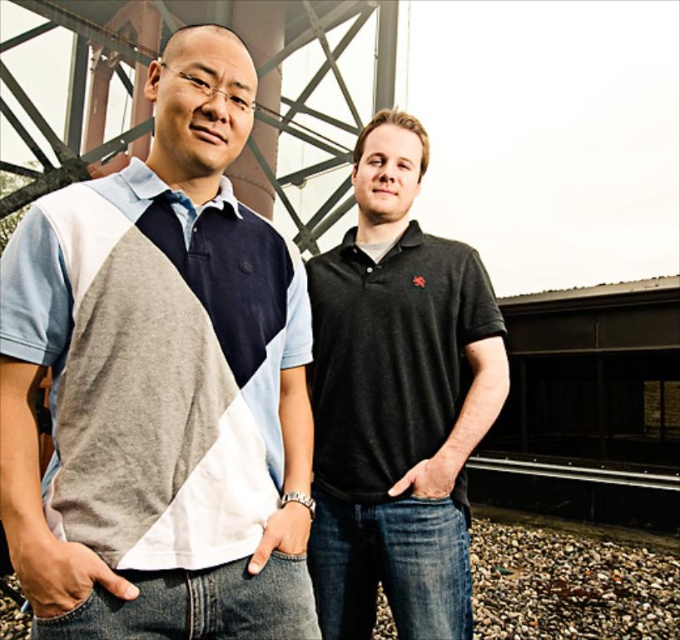
Question: Is tri-color polo shirt at left further to camera compared to black matte polo shirt at center?

Choices:
 (A) no
 (B) yes

Answer: (A)

Question: Does tri-color polo shirt at left have a larger size compared to black matte polo shirt at center?

Choices:
 (A) yes
 (B) no

Answer: (B)

Question: Observing the image, what is the correct spatial positioning of tri-color polo shirt at left in reference to black matte polo shirt at center?

Choices:
 (A) below
 (B) above

Answer: (B)